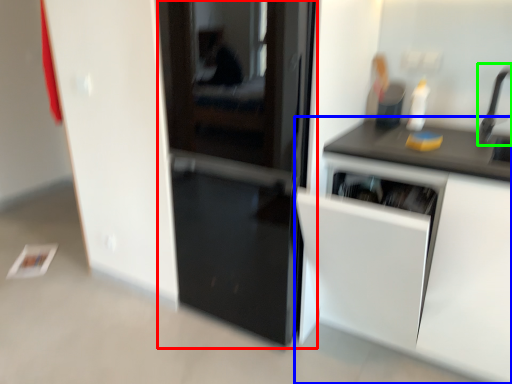
Question: Estimate the real-world distances between objects in this image. Which object is farther from door (highlighted by a red box), cabinetry (highlighted by a blue box) or faucet (highlighted by a green box)?

Choices:
 (A) cabinetry
 (B) faucet

Answer: (B)